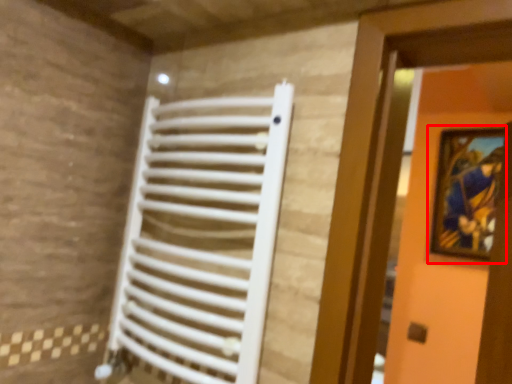
Question: From the image's perspective, where is picture frame (annotated by the red box) located relative to radiator?

Choices:
 (A) above
 (B) below

Answer: (A)